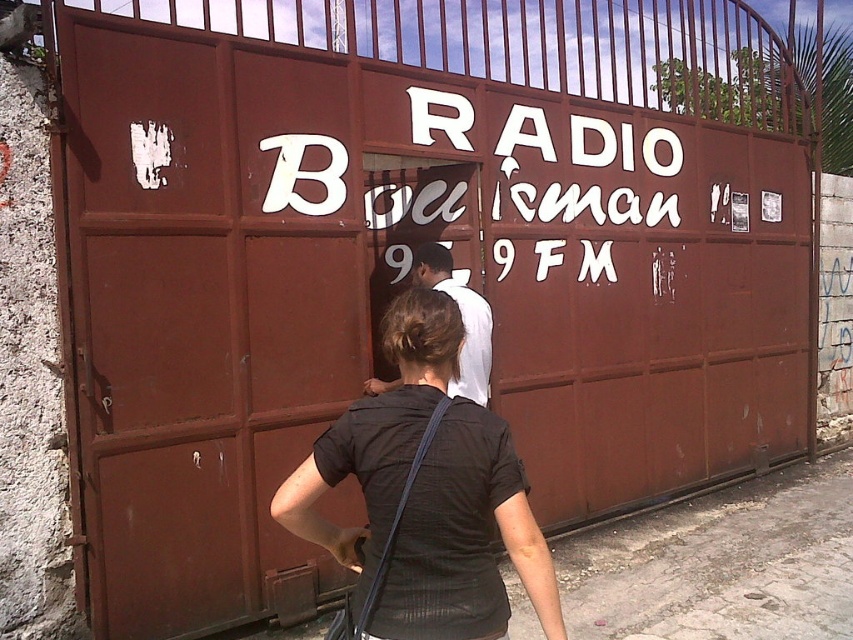
Does black matte shirt at center have a greater width compared to white cloth shirt at center?

Indeed, black matte shirt at center has a greater width compared to white cloth shirt at center.

Looking at this image, is black matte shirt at center to the right of white cloth shirt at center from the viewer's perspective?

No, black matte shirt at center is not to the right of white cloth shirt at center.

Does point (438, 538) come behind point (415, 259)?

No.

Locate an element on the screen. The width and height of the screenshot is (853, 640). black matte shirt at center is located at coordinates (465, 540).